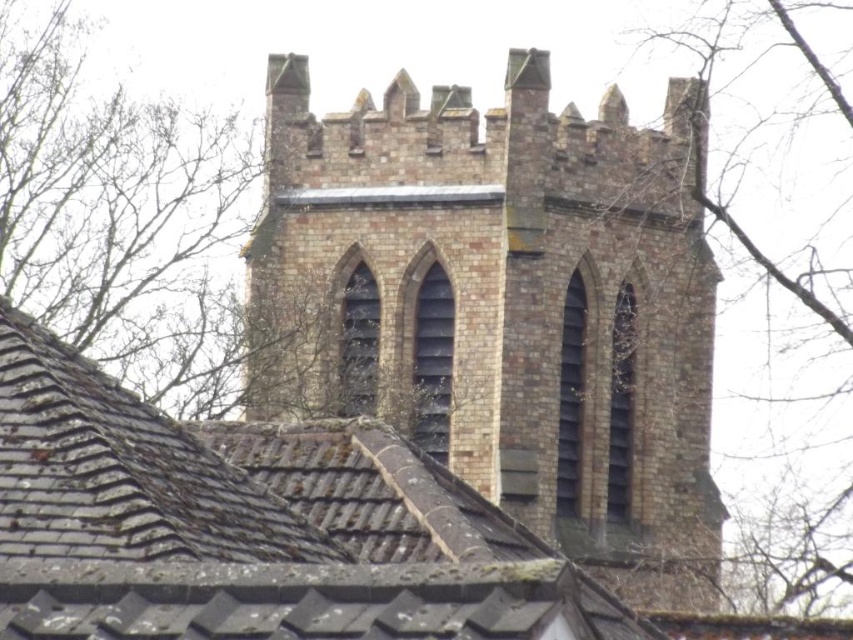
Does brown brick church at center have a lesser width compared to brown tile roof at upper center?

No, brown brick church at center is not thinner than brown tile roof at upper center.

Is point (524, 188) farther from camera compared to point (374, 467)?

Yes, point (524, 188) is behind point (374, 467).

Locate an element on the screen. brown brick church at center is located at coordinates (503, 305).

Can you confirm if brown tile roof at upper center is positioned to the left of bare branches at upper left?

No, brown tile roof at upper center is not to the left of bare branches at upper left.

Image resolution: width=853 pixels, height=640 pixels. What do you see at coordinates (251, 525) in the screenshot? I see `brown tile roof at upper center` at bounding box center [251, 525].

This screenshot has width=853, height=640. Describe the element at coordinates (251, 525) in the screenshot. I see `brown tile roof at upper center` at that location.

I want to click on brown tile roof at upper center, so click(x=251, y=525).

The height and width of the screenshot is (640, 853). What are the coordinates of `brown tile roof at upper center` in the screenshot? It's located at (251, 525).

Image resolution: width=853 pixels, height=640 pixels. I want to click on brown tile roof at upper center, so click(x=251, y=525).

The image size is (853, 640). In order to click on brown tile roof at upper center in this screenshot , I will do `click(251, 525)`.